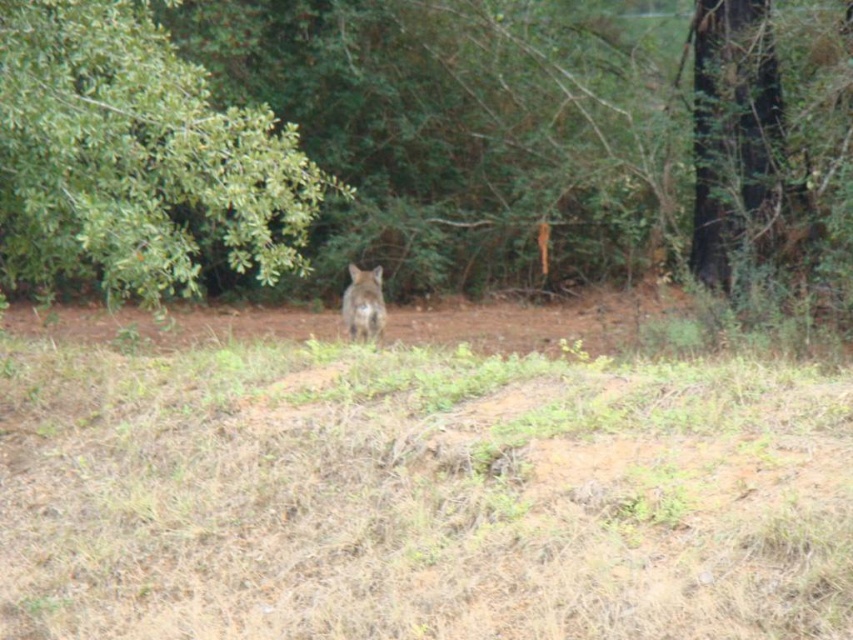
Question: Is green leafy forest at center to the right of brown rough bark tree at upper right from the viewer's perspective?

Choices:
 (A) no
 (B) yes

Answer: (A)

Question: Which object is closer to the camera taking this photo?

Choices:
 (A) green leafy forest at center
 (B) green leafy tree at upper left
 (C) brown fur at center
 (D) brown rough bark tree at upper right

Answer: (B)

Question: Does green leafy forest at center have a lesser width compared to green leafy tree at upper left?

Choices:
 (A) yes
 (B) no

Answer: (B)

Question: Among these objects, which one is farthest from the camera?

Choices:
 (A) green leafy forest at center
 (B) green leafy tree at upper left
 (C) brown fur at center

Answer: (C)

Question: Which point is farther to the camera?

Choices:
 (A) green leafy tree at upper left
 (B) brown rough bark tree at upper right
 (C) brown fur at center

Answer: (B)

Question: Does green leafy tree at upper left have a smaller size compared to brown fur at center?

Choices:
 (A) no
 (B) yes

Answer: (A)